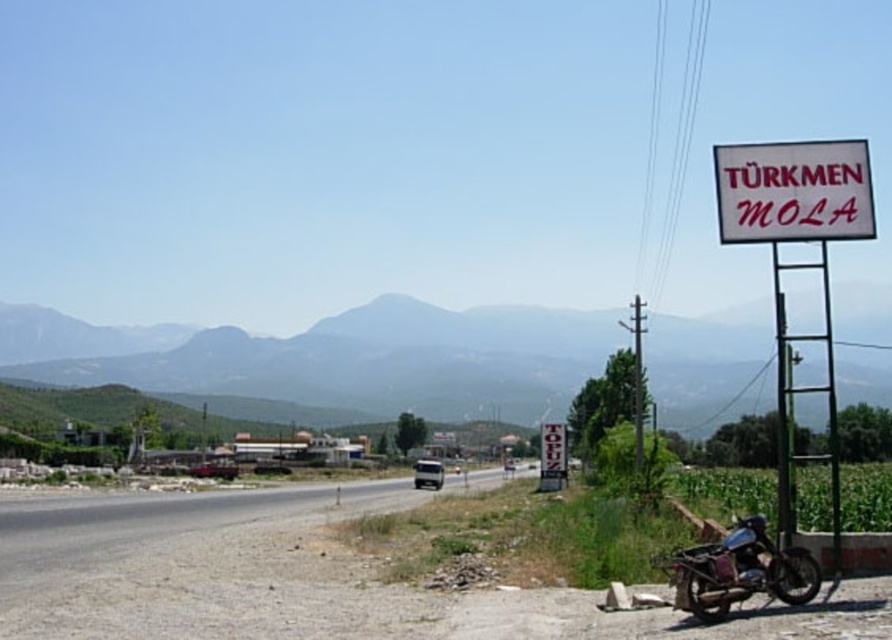
Question: Can you confirm if green grassy mountain at upper center is bigger than metallic brown motorbike at lower right?

Choices:
 (A) yes
 (B) no

Answer: (A)

Question: Based on their relative distances, which object is farther from the white plastic sign at upper right?

Choices:
 (A) green grassy mountain at upper center
 (B) metallic brown motorbike at lower right

Answer: (A)

Question: Which object is positioned closest to the green grassy mountain at upper center?

Choices:
 (A) white plastic sign at upper right
 (B) white plastic sign at right

Answer: (B)

Question: Among these objects, which one is farthest from the camera?

Choices:
 (A) white plastic sign at upper right
 (B) metallic brown motorbike at lower right

Answer: (A)

Question: Does white plastic sign at right appear on the left side of white plastic sign at upper right?

Choices:
 (A) no
 (B) yes

Answer: (A)

Question: Can you confirm if green grassy mountain at upper center is positioned below white plastic sign at right?

Choices:
 (A) yes
 (B) no

Answer: (B)